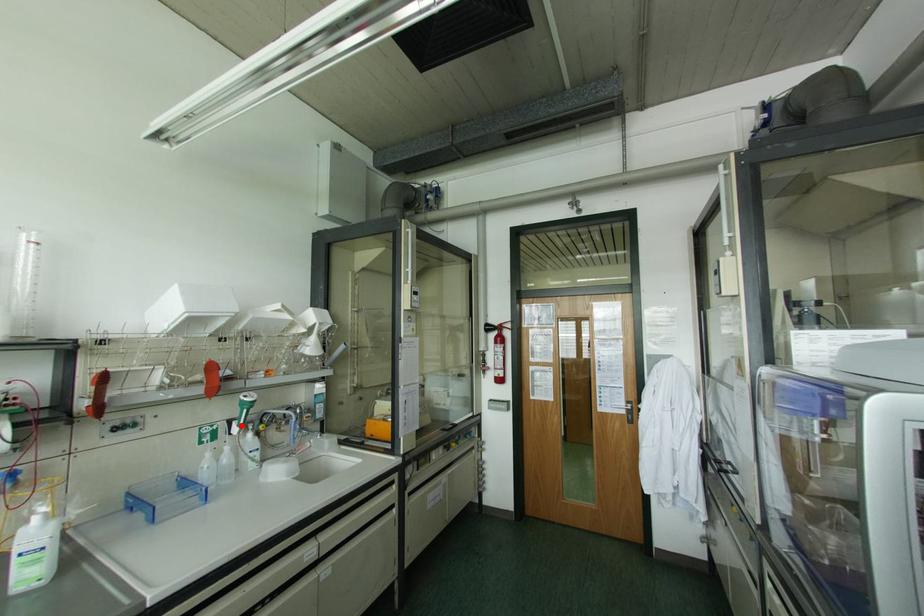
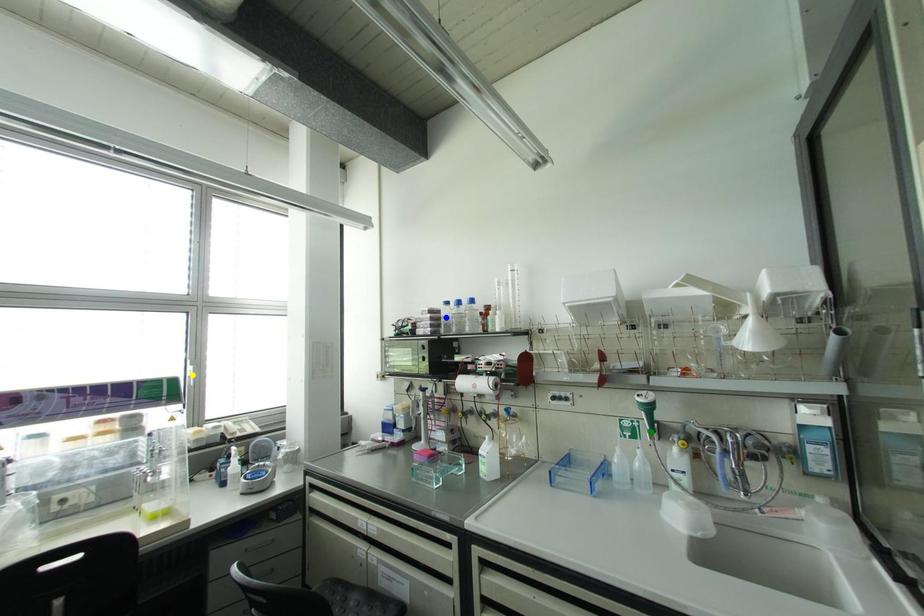
Question: I am providing you with two images of the same scene from different viewpoints. A red point is marked on the first image. You are given multiple points on the second image. Can you choose the point in image 2 that corresponds to the point in image 1?

Choices:
 (A) blue point
 (B) green point
 (C) yellow point

Answer: (B)